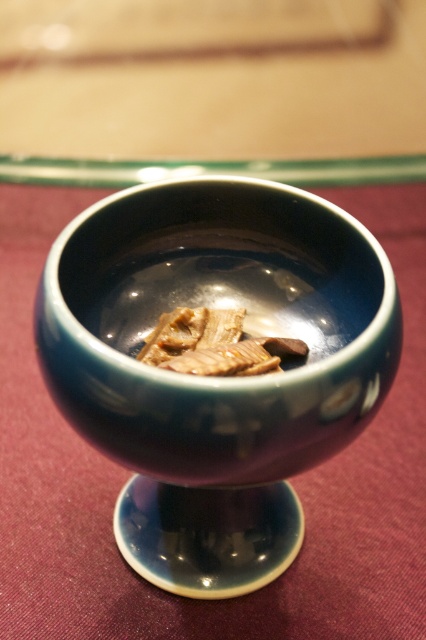
Does blue glossy bowl at center have a smaller size compared to brown matte meat at center?

No.

Measure the distance between point (51, 568) and camera.

Point (51, 568) is 1.08 meters from camera.

I want to click on blue glossy bowl at center, so click(129, 472).